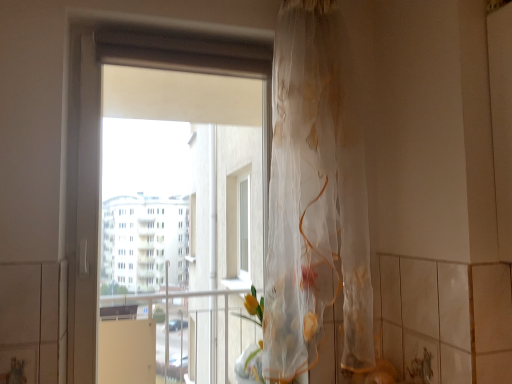
What do you see at coordinates (315, 198) in the screenshot? The height and width of the screenshot is (384, 512). I see `translucent floral-patterned curtain at center` at bounding box center [315, 198].

The image size is (512, 384). Find the location of `translucent floral-patterned curtain at center`. translucent floral-patterned curtain at center is located at coordinates (315, 198).

In order to face translucent floral-patterned curtain at center, should I rotate leftwards or rightwards?

To align with it, rotate right about 10.410°.

What do you see at coordinates (99, 151) in the screenshot?
I see `transparent plastic window at center` at bounding box center [99, 151].

You are a GUI agent. You are given a task and a screenshot of the screen. Output one action in this format:
    pyautogui.click(x=<x>, y=<y>)
    Task: Click on the transparent plastic window at center
    
    Given the screenshot: What is the action you would take?
    pyautogui.click(x=99, y=151)

This screenshot has width=512, height=384. In order to click on translucent floral-patterned curtain at center in this screenshot , I will do `click(315, 198)`.

Which is more to the left, translucent floral-patterned curtain at center or transparent plastic window at center?

transparent plastic window at center.

Does translucent floral-patterned curtain at center lie behind transparent plastic window at center?

No, translucent floral-patterned curtain at center is closer to the viewer.

Considering the points (324, 261) and (75, 300), which point is behind, point (324, 261) or point (75, 300)?

The point (75, 300) is farther.

From the image's perspective, is translucent floral-patterned curtain at center on transparent plastic window at center?

Yes, from the image's perspective, translucent floral-patterned curtain at center is above transparent plastic window at center.

From a real-world perspective, is translucent floral-patterned curtain at center physically above transparent plastic window at center?

Correct, in the physical world, translucent floral-patterned curtain at center is higher than transparent plastic window at center.

Which of these two, translucent floral-patterned curtain at center or transparent plastic window at center, is thinner?

transparent plastic window at center is thinner.

Who is taller, translucent floral-patterned curtain at center or transparent plastic window at center?

transparent plastic window at center is taller.

Considering the sizes of objects translucent floral-patterned curtain at center and transparent plastic window at center in the image provided, who is smaller, translucent floral-patterned curtain at center or transparent plastic window at center?

transparent plastic window at center is smaller.

Which is correct: translucent floral-patterned curtain at center is inside transparent plastic window at center, or outside of it?

translucent floral-patterned curtain at center is not inside transparent plastic window at center, it's outside.

Is translucent floral-patterned curtain at center next to transparent plastic window at center and touching it?

No, translucent floral-patterned curtain at center is not touching transparent plastic window at center.

Is translucent floral-patterned curtain at center aimed at transparent plastic window at center?

No, translucent floral-patterned curtain at center is not aimed at transparent plastic window at center.

How different are the orientations of translucent floral-patterned curtain at center and transparent plastic window at center in degrees?

The angular difference between translucent floral-patterned curtain at center and transparent plastic window at center is 1.03 degrees.

How far apart are translucent floral-patterned curtain at center and transparent plastic window at center?

translucent floral-patterned curtain at center and transparent plastic window at center are 22.95 inches apart.

Image resolution: width=512 pixels, height=384 pixels. What are the coordinates of `window below the translucent floral-patterned curtain at center (from a real-world perspective)` in the screenshot? It's located at (99, 151).

Considering the relative positions of transparent plastic window at center and translucent floral-patterned curtain at center in the image provided, is transparent plastic window at center to the left or to the right of translucent floral-patterned curtain at center?

Clearly, transparent plastic window at center is on the left of translucent floral-patterned curtain at center in the image.

From the picture: Which object is closer to the camera, transparent plastic window at center or translucent floral-patterned curtain at center?

translucent floral-patterned curtain at center is closer to the camera.

Considering the positions of points (108, 37) and (334, 226), is point (108, 37) farther from camera compared to point (334, 226)?

Yes, it is.

From the image's perspective, which one is positioned higher, transparent plastic window at center or translucent floral-patterned curtain at center?

translucent floral-patterned curtain at center appears higher in the image.

From a real-world perspective, between transparent plastic window at center and translucent floral-patterned curtain at center, who is vertically lower?

transparent plastic window at center.

Is transparent plastic window at center wider or thinner than translucent floral-patterned curtain at center?

In the image, transparent plastic window at center appears to be more narrow than translucent floral-patterned curtain at center.

Between transparent plastic window at center and translucent floral-patterned curtain at center, which one has less height?

translucent floral-patterned curtain at center is shorter.

Does transparent plastic window at center have a larger size compared to translucent floral-patterned curtain at center?

Actually, transparent plastic window at center might be smaller than translucent floral-patterned curtain at center.

Does transparent plastic window at center contain translucent floral-patterned curtain at center?

No, translucent floral-patterned curtain at center is not inside transparent plastic window at center.

Are transparent plastic window at center and translucent floral-patterned curtain at center far apart?

No, transparent plastic window at center is not far away from translucent floral-patterned curtain at center.

Is transparent plastic window at center facing towards translucent floral-patterned curtain at center?

Yes.

Could you measure the distance between transparent plastic window at center and translucent floral-patterned curtain at center?

The distance of transparent plastic window at center from translucent floral-patterned curtain at center is 22.95 inches.

This screenshot has height=384, width=512. Find the location of `window that is behind the translucent floral-patterned curtain at center`. window that is behind the translucent floral-patterned curtain at center is located at coordinates (99, 151).

In order to click on window that is on the left side of translucent floral-patterned curtain at center in this screenshot , I will do `click(99, 151)`.

The image size is (512, 384). What are the coordinates of `curtain located above the transparent plastic window at center (from a real-world perspective)` in the screenshot? It's located at (315, 198).